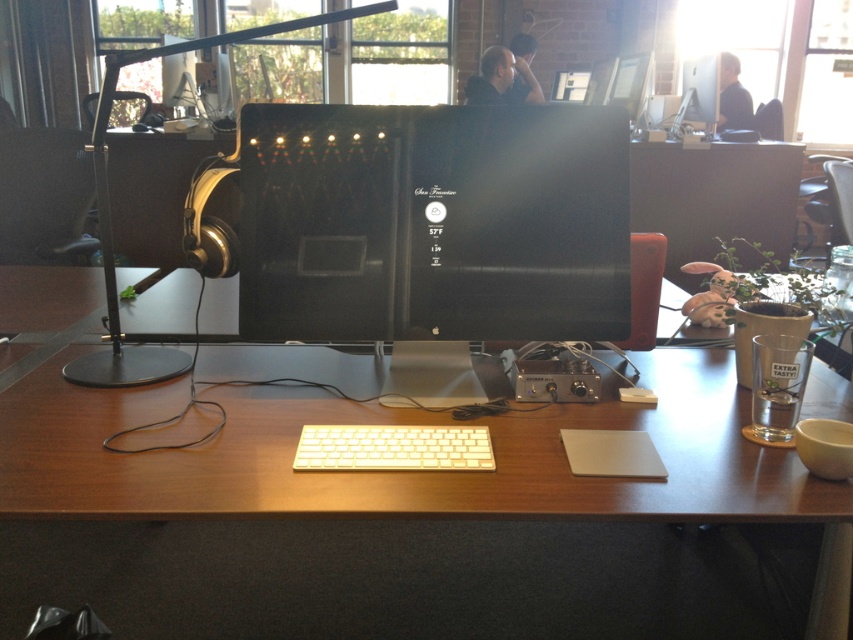
You are sitting at the desk in the workspace and notice two points marked on the floor. The first point is at coordinate point [598,180] and the second is at point [148,353]. If you want to place a new item on the floor between these two points, which point should you move towards to ensure the item is closer to the desk?

You should move towards point [598,180] because it is in front of point [148,353], meaning it is closer to the desk.

You are setting up a new monitor stand for your computer monitor. The stand requires a surface that is at least as tall as the white plastic keyboard at center. Based on the scene, is the wooden table at center a suitable surface for the stand?

The wooden table at center is taller than the white plastic keyboard at center, so yes, it is suitable for the monitor stand.